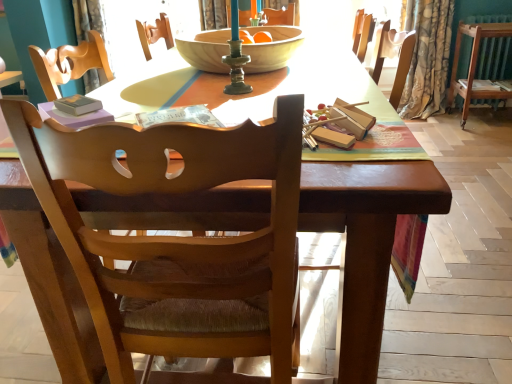
Where is `matte purple paperback book at right, arranged as the 1th paperback book when viewed from the back`? The height and width of the screenshot is (384, 512). matte purple paperback book at right, arranged as the 1th paperback book when viewed from the back is located at coordinates (485, 85).

The width and height of the screenshot is (512, 384). What are the coordinates of `green metallic candle holder at center` in the screenshot? It's located at click(236, 57).

At what (x,y) coordinates should I click in order to perform the action: click on wooden bowl at center. Please return your answer as a coordinate pair (x, y). Looking at the image, I should click on (272, 48).

Consider the image. From a real-world perspective, between matte purple paperback book at right, arranged as the 1th paperback book when viewed from the back, and floral fabric curtain at right, positioned as the 1th curtain in right-to-left order, who is vertically lower?

A: From a 3D spatial view, matte purple paperback book at right, arranged as the 1th paperback book when viewed from the back, is below.

Between point (462, 84) and point (428, 40), which one is positioned behind?

The point (462, 84) is farther from the camera.

Considering the relative positions of matte purple paperback book at right, which is the 2th paperback book in front-to-back order, and floral fabric curtain at right, arranged as the 2th curtain when viewed from the left, in the image provided, is matte purple paperback book at right, which is the 2th paperback book in front-to-back order, to the left of floral fabric curtain at right, arranged as the 2th curtain when viewed from the left, from the viewer's perspective?

No, matte purple paperback book at right, which is the 2th paperback book in front-to-back order, is not to the left of floral fabric curtain at right, arranged as the 2th curtain when viewed from the left.

Between matte purple paperback book at right, which is the 2th paperback book in front-to-back order, and floral fabric curtain at right, arranged as the 2th curtain when viewed from the left, which one has larger size?

Bigger between the two is floral fabric curtain at right, arranged as the 2th curtain when viewed from the left.

From a real-world perspective, is light beige fabric curtain at upper left, which ranks as the 1th curtain in left-to-right order, physically above green metallic candle holder at center?

No, from a real-world perspective, light beige fabric curtain at upper left, which ranks as the 1th curtain in left-to-right order, is not on top of green metallic candle holder at center.

From the image's perspective, relative to green metallic candle holder at center, is light beige fabric curtain at upper left, which ranks as the 1th curtain in left-to-right order, above or below?

Clearly, from the image's perspective, light beige fabric curtain at upper left, which ranks as the 1th curtain in left-to-right order, is above green metallic candle holder at center.

Is light beige fabric curtain at upper left, which ranks as the 1th curtain in left-to-right order, taller or shorter than green metallic candle holder at center?

In the image, light beige fabric curtain at upper left, which ranks as the 1th curtain in left-to-right order, appears to be taller than green metallic candle holder at center.

Which object is thinner, light beige fabric curtain at upper left, which ranks as the 1th curtain in left-to-right order, or green metallic candle holder at center?

green metallic candle holder at center.

Is point (230, 40) in front of point (82, 8)?

Yes, it is.

Between green metallic candle holder at center and light beige fabric curtain at upper left, which ranks as the 1th curtain in left-to-right order, which one has smaller width?

Thinner between the two is green metallic candle holder at center.

Does green metallic candle holder at center have a larger size compared to light beige fabric curtain at upper left, which ranks as the 1th curtain in left-to-right order?

No.

Starting from the hardcover book at upper left, which is the second paperback book in top-to-bottom order, which curtain is the 1st one behind? Please provide its 2D coordinates.

[(428, 60)]

Is floral fabric curtain at right, positioned as the 1th curtain in right-to-left order, positioned with its back to hardcover book at upper left, arranged as the second paperback book when viewed from the right?

No, floral fabric curtain at right, positioned as the 1th curtain in right-to-left order, is not facing away from hardcover book at upper left, arranged as the second paperback book when viewed from the right.

Considering the points (437, 110) and (96, 99), which point is behind, point (437, 110) or point (96, 99)?

Positioned behind is point (437, 110).

Is floral fabric curtain at right, arranged as the 2th curtain when viewed from the left, placed right next to hardcover book at upper left, the first paperback book from the front?

floral fabric curtain at right, arranged as the 2th curtain when viewed from the left, and hardcover book at upper left, the first paperback book from the front, are not in contact.

Is green metallic candle holder at center oriented towards wooden chair at center?

No, green metallic candle holder at center is not facing towards wooden chair at center.

Which object is further away from the camera taking this photo, green metallic candle holder at center or wooden chair at center?

green metallic candle holder at center is further from the camera.

Which is nearer, (237, 2) or (44, 194)?

Point (237, 2).

Who is shorter, green metallic candle holder at center or wooden chair at center?

green metallic candle holder at center.

Is floral fabric curtain at right, arranged as the 2th curtain when viewed from the left, looking in the opposite direction of green metallic candle holder at center?

No, floral fabric curtain at right, arranged as the 2th curtain when viewed from the left, is not facing the opposite direction of green metallic candle holder at center.

Does floral fabric curtain at right, positioned as the 1th curtain in right-to-left order, appear on the right side of green metallic candle holder at center?

Yes.

Can you confirm if floral fabric curtain at right, positioned as the 1th curtain in right-to-left order, is taller than green metallic candle holder at center?

Yes.

Is matte purple paperback book at right, the 2th paperback book in the bottom-to-top sequence, at the left side of wooden chair at center?

Incorrect, matte purple paperback book at right, the 2th paperback book in the bottom-to-top sequence, is not on the left side of wooden chair at center.

Between matte purple paperback book at right, arranged as the second paperback book when viewed from the left, and wooden chair at center, which one has smaller width?

matte purple paperback book at right, arranged as the second paperback book when viewed from the left, is thinner.

Is matte purple paperback book at right, the first paperback book when ordered from top to bottom, inside the boundaries of wooden chair at center, or outside?

matte purple paperback book at right, the first paperback book when ordered from top to bottom, cannot be found inside wooden chair at center.

Identify the location of curtain in front of the matte purple paperback book at right, arranged as the 1th paperback book when viewed from the back. (428, 60).

From the green metallic candle holder at center, count 2nd curtains backward and point to it. Please provide its 2D coordinates.

[(88, 18)]

When comparing their distances from wooden bowl at center, does floral fabric curtain at right, arranged as the 2th curtain when viewed from the left, or hardcover book at upper left, arranged as the 1th paperback book when viewed from the left, seem further?

floral fabric curtain at right, arranged as the 2th curtain when viewed from the left, lies further to wooden bowl at center than the other object.

Estimate the real-world distances between objects in this image. Which object is closer to wooden chair at center, hardcover book at upper left, which is the second paperback book in top-to-bottom order, or wooden bowl at center?

Based on the image, hardcover book at upper left, which is the second paperback book in top-to-bottom order, appears to be nearer to wooden chair at center.

Which object lies nearer to the anchor point hardcover book at upper left, marked as the 1th paperback book in a bottom-to-top arrangement, wooden bowl at center or wooden chair at center?

Among the two, wooden chair at center is located nearer to hardcover book at upper left, marked as the 1th paperback book in a bottom-to-top arrangement.

Consider the image. Based on their spatial positions, is matte purple paperback book at right, which is the 1th paperback book in right-to-left order, or light beige fabric curtain at upper left, which ranks as the 1th curtain in left-to-right order, closer to wooden bowl at center?

Among the two, light beige fabric curtain at upper left, which ranks as the 1th curtain in left-to-right order, is located nearer to wooden bowl at center.

Which object lies further to the anchor point wooden chair at center, floral fabric curtain at right, arranged as the 2th curtain when viewed from the left, or light beige fabric curtain at upper left, arranged as the 2th curtain when viewed from the right?

light beige fabric curtain at upper left, arranged as the 2th curtain when viewed from the right.

From the image, which object appears to be farther from wooden chair at center, wooden bowl at center or hardcover book at upper left, which is the second paperback book in top-to-bottom order?

wooden bowl at center is positioned further to the anchor wooden chair at center.

Based on their spatial positions, is matte purple paperback book at right, which is the 2th paperback book in front-to-back order, or light beige fabric curtain at upper left, which ranks as the 1th curtain in left-to-right order, further from floral fabric curtain at right, arranged as the 2th curtain when viewed from the left?

light beige fabric curtain at upper left, which ranks as the 1th curtain in left-to-right order, is positioned further to the anchor floral fabric curtain at right, arranged as the 2th curtain when viewed from the left.

Which object lies nearer to the anchor point wooden bowl at center, green metallic candle holder at center or matte purple paperback book at right, which is the 2th paperback book in front-to-back order?

Among the two, green metallic candle holder at center is located nearer to wooden bowl at center.

Locate an element on the screen. Image resolution: width=512 pixels, height=384 pixels. candle holder between light beige fabric curtain at upper left, which ranks as the 1th curtain in left-to-right order, and floral fabric curtain at right, positioned as the 1th curtain in right-to-left order is located at coordinates (x=236, y=57).

What are the coordinates of `curtain between wooden bowl at center and matte purple paperback book at right, arranged as the 1th paperback book when viewed from the back, along the z-axis` in the screenshot? It's located at (428, 60).

You are a GUI agent. You are given a task and a screenshot of the screen. Output one action in this format:
    pyautogui.click(x=<x>, y=<y>)
    Task: Click on the bowl located between hardcover book at upper left, the 2th paperback book in the back-to-front sequence, and floral fabric curtain at right, arranged as the 2th curtain when viewed from the left, in the depth direction
    
    Given the screenshot: What is the action you would take?
    pyautogui.click(x=272, y=48)

Locate an element on the screen. The width and height of the screenshot is (512, 384). bowl located between hardcover book at upper left, which is the second paperback book in top-to-bottom order, and light beige fabric curtain at upper left, arranged as the 2th curtain when viewed from the right, in the depth direction is located at coordinates (272, 48).